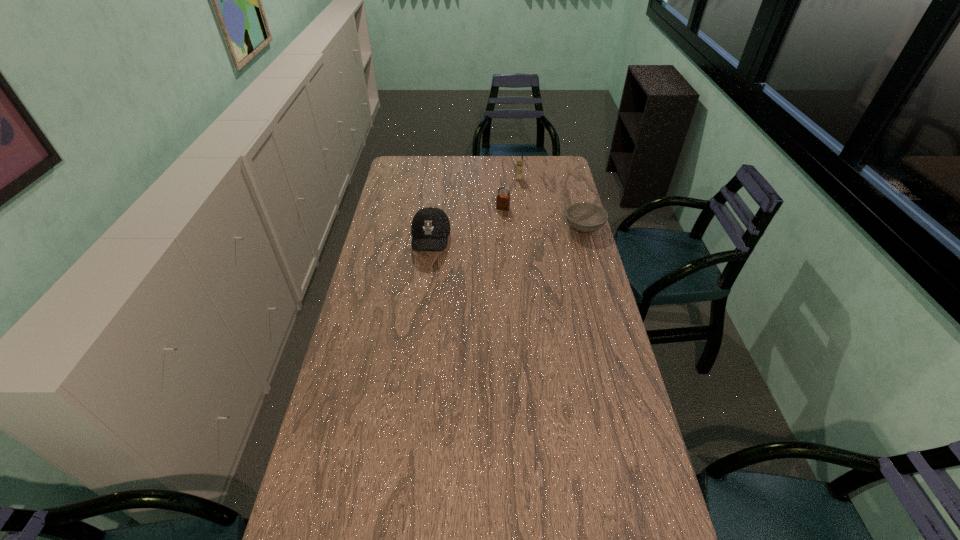
The image size is (960, 540). What are the coordinates of `baseball cap` in the screenshot? It's located at (430, 228).

Locate an element on the screen. The width and height of the screenshot is (960, 540). the rightmost object is located at coordinates (586, 217).

You are a GUI agent. You are given a task and a screenshot of the screen. Output one action in this format:
    pyautogui.click(x=<x>, y=<y>)
    Task: Click on the shortest object
    
    Given the screenshot: What is the action you would take?
    pyautogui.click(x=586, y=217)

Where is `the farthest object`? The width and height of the screenshot is (960, 540). the farthest object is located at coordinates (519, 166).

The height and width of the screenshot is (540, 960). I want to click on the tallest object, so click(x=519, y=166).

I want to click on padlock, so click(x=503, y=201).

This screenshot has height=540, width=960. I want to click on the third object from right to left, so click(503, 201).

The height and width of the screenshot is (540, 960). Find the location of `vacant area situated on the front-facing side of the baseball cap`. vacant area situated on the front-facing side of the baseball cap is located at coordinates point(423,299).

Identify the location of blank space located on the back of the shortest object. This screenshot has height=540, width=960. (579, 205).

The width and height of the screenshot is (960, 540). In order to click on vacant area situated 0.190m on the front of the tallest object, where the keypad is located in this screenshot , I will do `click(518, 203)`.